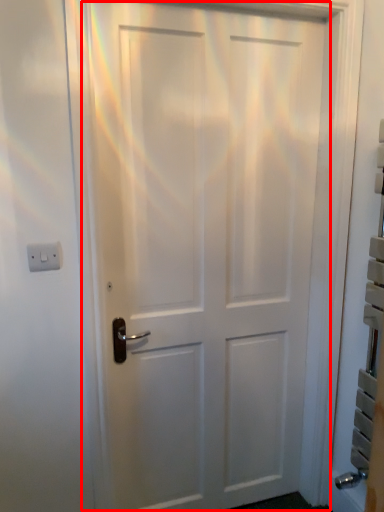
Question: From the image, what is the correct spatial relationship of door (annotated by the red box) in relation to light switch?

Choices:
 (A) left
 (B) right

Answer: (B)